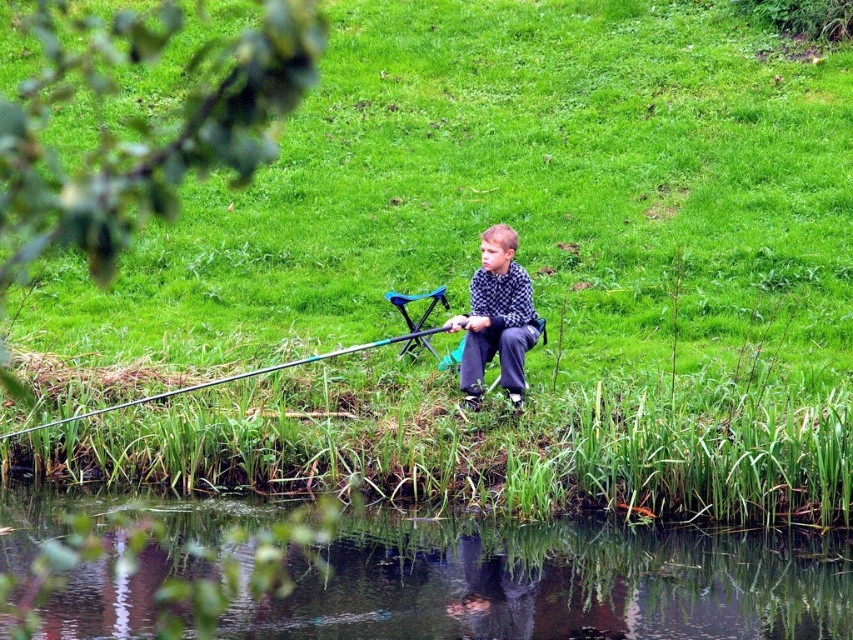
Question: Which object appears closest to the camera in this image?

Choices:
 (A) transparent water at lower center
 (B) checkered fabric shirt at center

Answer: (A)

Question: Among these objects, which one is nearest to the camera?

Choices:
 (A) checkered fabric shirt at center
 (B) teal glossy fishing pole at lower center

Answer: (B)

Question: Which point is farther to the camera?

Choices:
 (A) teal glossy fishing pole at lower center
 (B) checkered fabric shirt at center

Answer: (B)

Question: Does checkered fabric shirt at center have a smaller size compared to teal glossy fishing pole at lower center?

Choices:
 (A) no
 (B) yes

Answer: (B)

Question: Is transparent water at lower center behind teal glossy fishing pole at lower center?

Choices:
 (A) yes
 (B) no

Answer: (B)

Question: Is transparent water at lower center below teal glossy fishing pole at lower center?

Choices:
 (A) no
 (B) yes

Answer: (B)